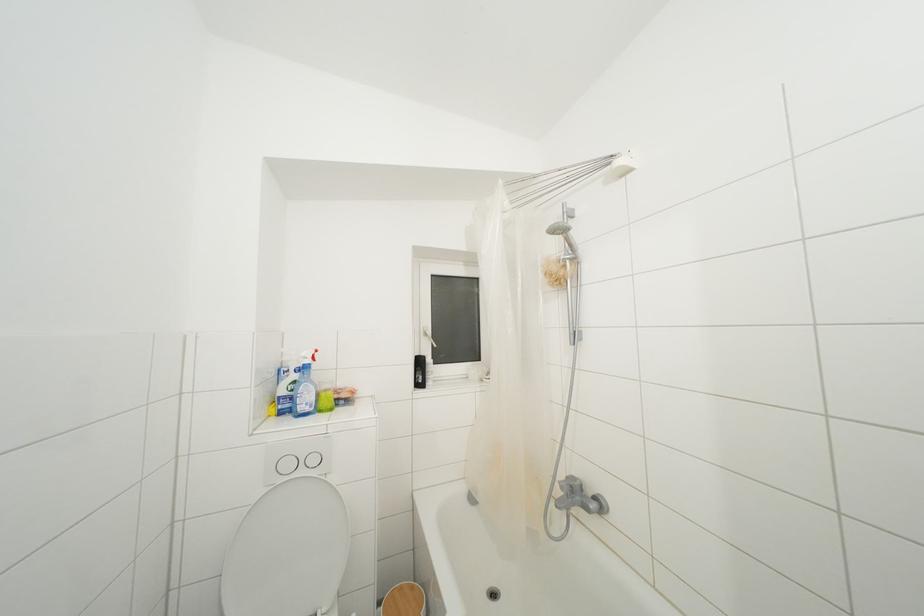
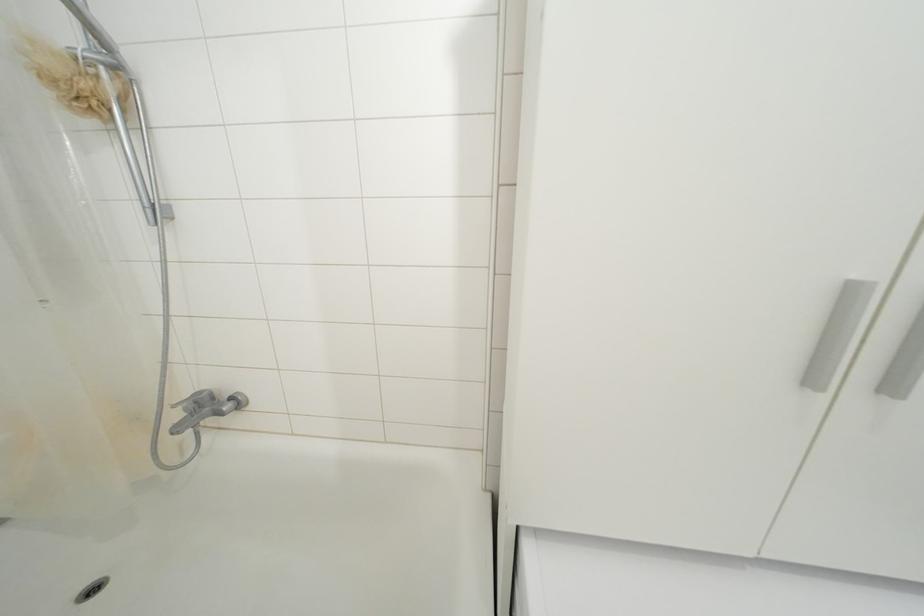
First-person continuous shooting, in which direction is the camera rotating?

The rotation direction of the camera is right-down.